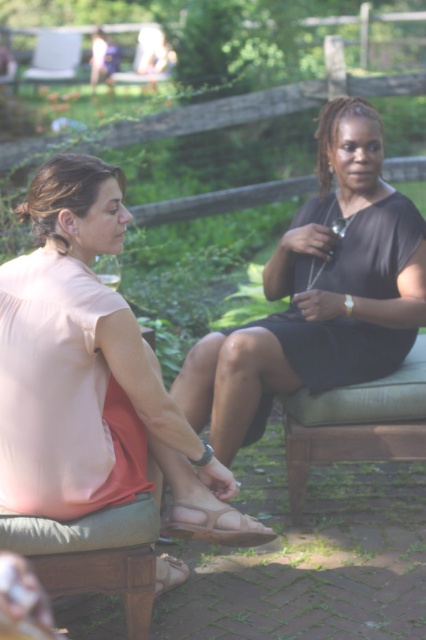
You are a photographer trying to capture a closeup of the matte black dress at center without including the green fabric bench at center in the frame. Based on their positions, is this possible?

The matte black dress at center is above the green fabric bench at center, so it is possible to capture a closeup of the matte black dress at center without including the green fabric bench at center in the frame by focusing on the upper area where the dress is positioned.